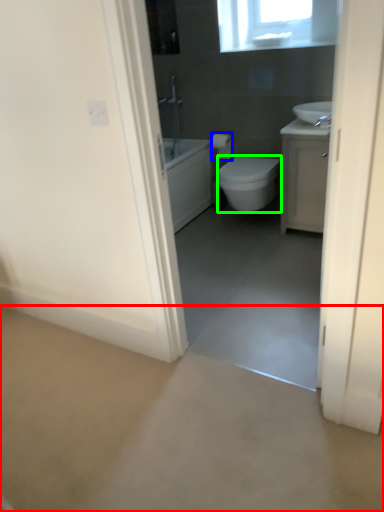
Question: Based on their relative distances, which object is nearer to concrete (highlighted by a red box)? Choose from toilet paper (highlighted by a blue box) and bidet (highlighted by a green box).

Choices:
 (A) toilet paper
 (B) bidet

Answer: (B)